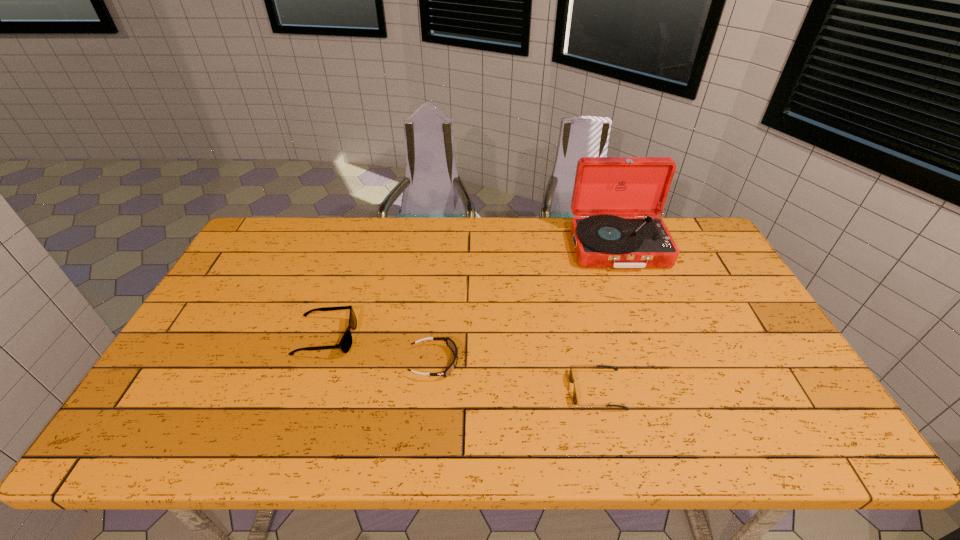
I want to click on free space that satisfies the following two spatial constraints: 1. on the front-facing side of the phonograph_record; 2. on the front and sides of the goggles, so click(661, 362).